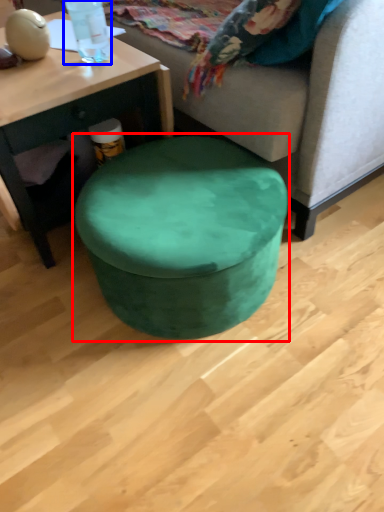
Question: Which point is further to the camera, music stool (highlighted by a red box) or bottle (highlighted by a blue box)?

Choices:
 (A) music stool
 (B) bottle

Answer: (B)